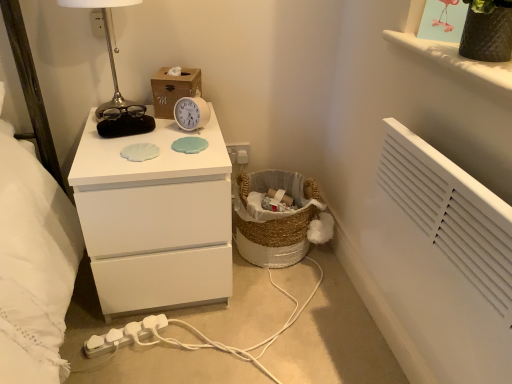
At what (x,y) coordinates should I click in order to perform the action: click on vacant space to the right of white plastic extension cord at lower left. Please return your answer as a coordinate pair (x, y). The height and width of the screenshot is (384, 512). Looking at the image, I should click on (182, 344).